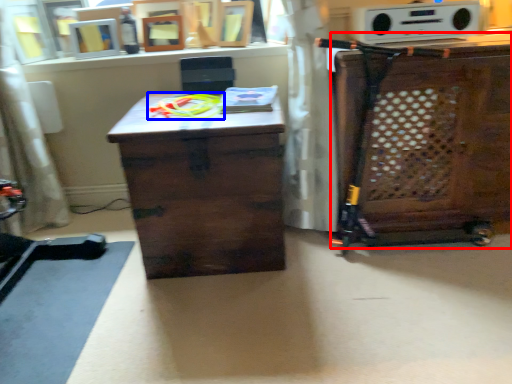
Question: Which of the following is the farthest to the observer, cabinetry (highlighted by a red box) or toy (highlighted by a blue box)?

Choices:
 (A) cabinetry
 (B) toy

Answer: (B)